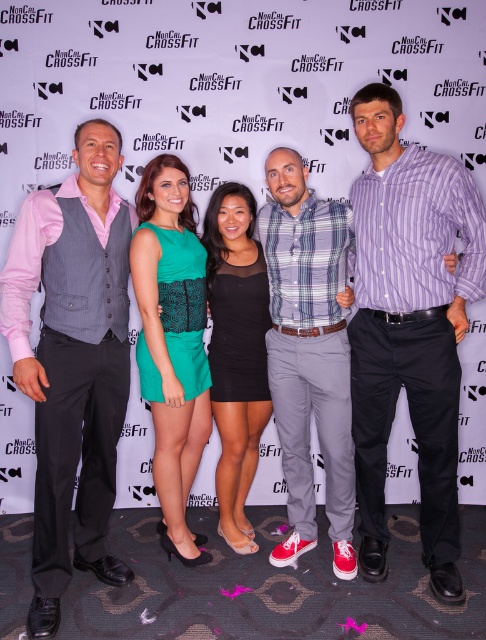
Who is positioned more to the left, plaid cotton shirt at center or green textured dress at center?

From the viewer's perspective, green textured dress at center appears more on the left side.

Which is above, plaid cotton shirt at center or green textured dress at center?

Positioned higher is plaid cotton shirt at center.

The height and width of the screenshot is (640, 486). Describe the element at coordinates (309, 353) in the screenshot. I see `plaid cotton shirt at center` at that location.

Where is `plaid cotton shirt at center`? The image size is (486, 640). plaid cotton shirt at center is located at coordinates (309, 353).

Which is above, purple striped shirt at center or plaid cotton shirt at center?

purple striped shirt at center is higher up.

Is purple striped shirt at center thinner than plaid cotton shirt at center?

In fact, purple striped shirt at center might be wider than plaid cotton shirt at center.

Which is behind, point (369, 92) or point (341, 564)?

The point (341, 564) is more distant.

The image size is (486, 640). Identify the location of purple striped shirt at center. (410, 326).

Is point (342, 456) closer to camera compared to point (253, 273)?

Yes.

Which is more to the right, plaid cotton shirt at center or black lace dress at center?

plaid cotton shirt at center

At what (x,y) coordinates should I click in order to perform the action: click on plaid cotton shirt at center. Please return your answer as a coordinate pair (x, y). This screenshot has width=486, height=640. Looking at the image, I should click on point(309,353).

Locate an element on the screen. The width and height of the screenshot is (486, 640). plaid cotton shirt at center is located at coordinates (309, 353).